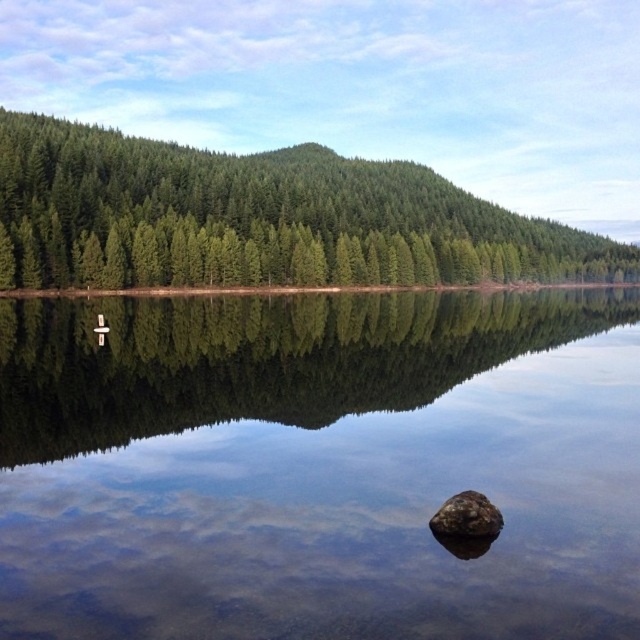
You are standing at the edge of the lake and see a point marked at coordinates (317, 465). According to the image, where exactly is this point located?

The point (317, 465) is located on the clear glass water at center.

You are an artist trying to sketch this scene. You want to ensure the green matte trees at upper center and the brown rough rock at center are proportionally accurate. Which object should you draw first to maintain the correct size relationship between them?

You should draw the green matte trees at upper center first since they are larger in size than the brown rough rock at center, ensuring proper scaling when adding the smaller rock later.

You are an artist trying to paint the scene. You want to ensure the clear glass water at center and the green matte trees at upper center are proportionally accurate. Which object should you paint first if you want to start with the larger one?

The green matte trees at upper center should be painted first since they are larger than the clear glass water at center according to the description.